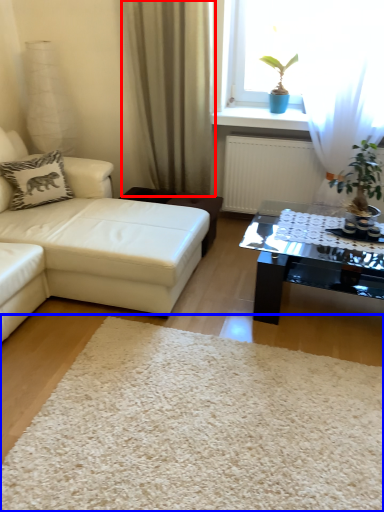
Question: Which object appears closest to the camera in this image, curtain (highlighted by a red box) or plain (highlighted by a blue box)?

Choices:
 (A) curtain
 (B) plain

Answer: (B)